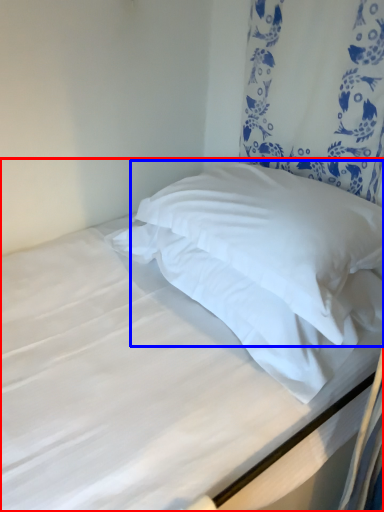
Question: Which point is further to the camera, bed (highlighted by a red box) or pillow (highlighted by a blue box)?

Choices:
 (A) bed
 (B) pillow

Answer: (B)